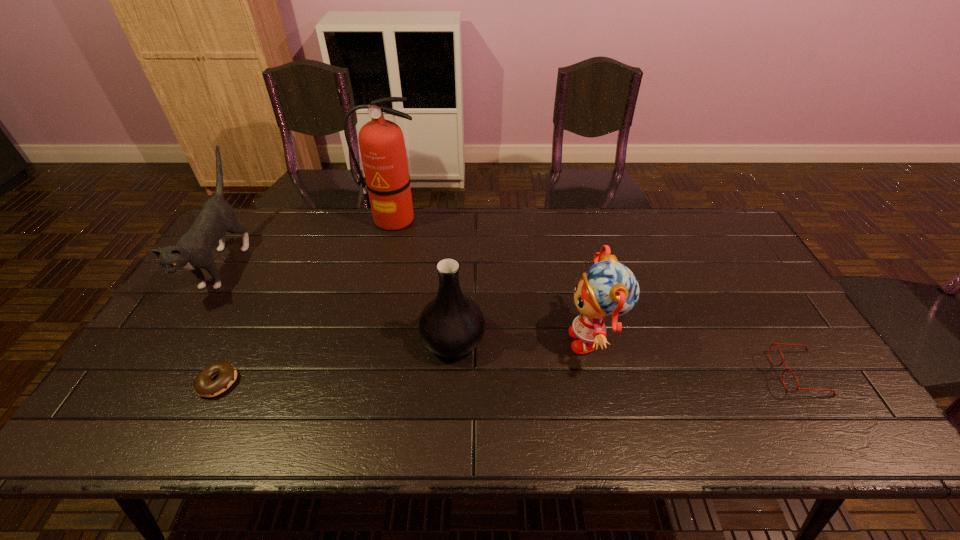
Locate an element on the screen. The width and height of the screenshot is (960, 540). object that is the third closest one to the shortest object is located at coordinates (382, 147).

Where is `blank space that satisfies the following two spatial constraints: 1. on the side of the tallest object with the nozzle and handle; 2. on the left side of the vase`? This screenshot has height=540, width=960. blank space that satisfies the following two spatial constraints: 1. on the side of the tallest object with the nozzle and handle; 2. on the left side of the vase is located at coordinates click(365, 340).